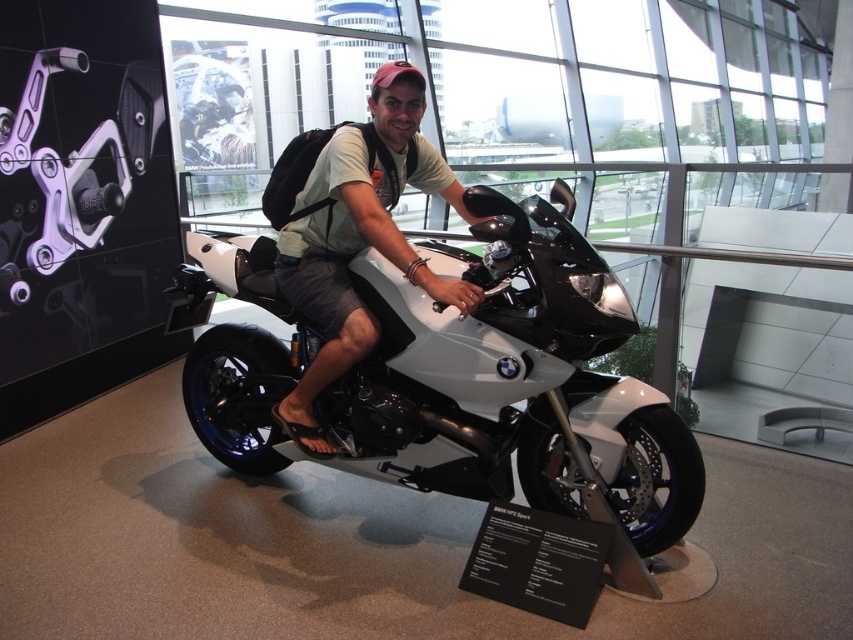
Question: Which object appears closest to the camera in this image?

Choices:
 (A) matte black motorcycle at center
 (B) white glossy motorcycle at center

Answer: (B)

Question: Which object is farther from the camera taking this photo?

Choices:
 (A) white glossy motorcycle at center
 (B) matte black motorcycle at center

Answer: (B)

Question: Which point is farther to the camera?

Choices:
 (A) (537, 438)
 (B) (398, 260)

Answer: (A)

Question: Does white glossy motorcycle at center have a greater width compared to matte black motorcycle at center?

Choices:
 (A) no
 (B) yes

Answer: (B)

Question: Observing the image, what is the correct spatial positioning of white glossy motorcycle at center in reference to matte black motorcycle at center?

Choices:
 (A) left
 (B) right

Answer: (A)

Question: Is white glossy motorcycle at center closer to camera compared to matte black motorcycle at center?

Choices:
 (A) yes
 (B) no

Answer: (A)